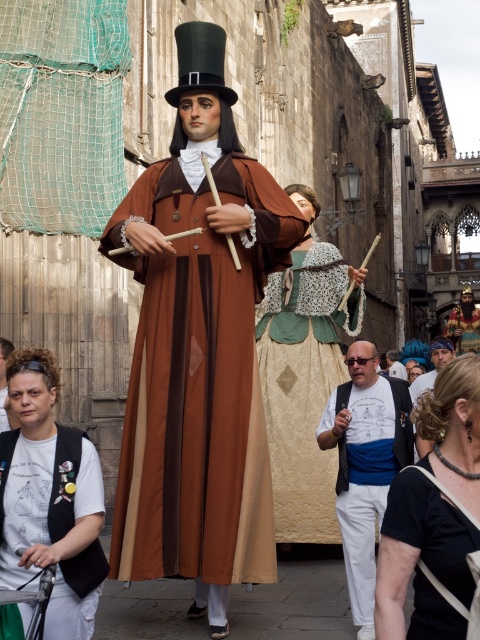
You are standing in the middle of the street looking at the two historical figures. Which of the two points, point (368, 433) or point (410, 384), is closer to you?

Point (368, 433) is closer to the camera than point (410, 384), so it is closer to you.

You are a costume designer preparing for a play. You have two items to place on a display stand. The black velvet vest at lower left and the gold metallic mask at center. The stand has a narrow shelf that can only hold items up to 10 cm in thickness. Which item should you choose to ensure it fits on the shelf?

The black velvet vest at lower left is thinner than the gold metallic mask at center, so it will fit on the narrow shelf that can only hold items up to 10 cm in thickness.

You are a photographer trying to capture both the black velvet vest at lower left and the gold metallic mask at center in a single frame. Can you focus on both objects clearly at the same time?

The black velvet vest at lower left is in front of the gold metallic mask at center, so focusing on both at the same time may be challenging due to their different distances from the camera.